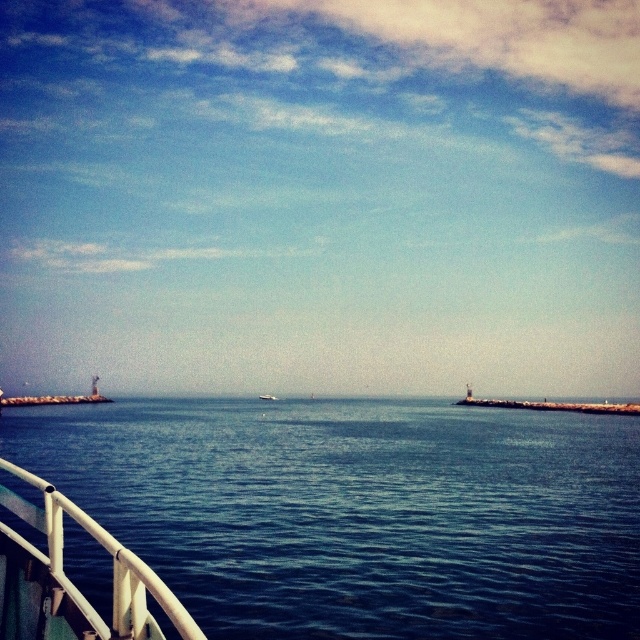
Can you confirm if blue water at lower left is wider than white matte railing at lower left?

Yes.

Who is higher up, blue water at lower left or white matte railing at lower left?

white matte railing at lower left

The height and width of the screenshot is (640, 640). Find the location of `blue water at lower left`. blue water at lower left is located at coordinates (358, 512).

The image size is (640, 640). I want to click on blue water at lower left, so click(x=358, y=512).

Can you confirm if blue water at lower left is taller than white plastic boat at center?

Correct, blue water at lower left is much taller as white plastic boat at center.

Is blue water at lower left further to the viewer compared to white plastic boat at center?

No, blue water at lower left is closer to the viewer.

Locate an element on the screen. This screenshot has height=640, width=640. blue water at lower left is located at coordinates (358, 512).

Does white matte railing at lower left appear under white plastic boat at center?

Incorrect, white matte railing at lower left is not positioned below white plastic boat at center.

Can you confirm if white matte railing at lower left is smaller than white plastic boat at center?

Yes, white matte railing at lower left is smaller than white plastic boat at center.

Describe the element at coordinates (113, 564) in the screenshot. I see `white matte railing at lower left` at that location.

Where is `white matte railing at lower left`? Image resolution: width=640 pixels, height=640 pixels. white matte railing at lower left is located at coordinates (113, 564).